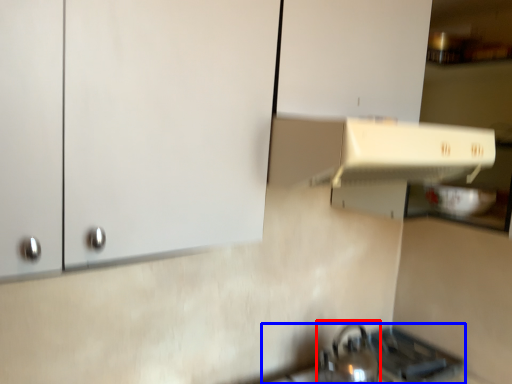
Question: Which object appears farthest to the camera in this image, tea pot (highlighted by a red box) or gas stove (highlighted by a blue box)?

Choices:
 (A) tea pot
 (B) gas stove

Answer: (B)